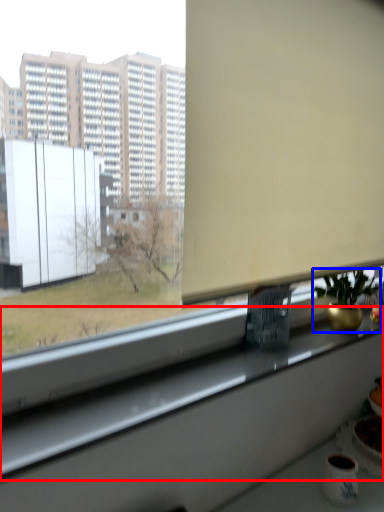
Question: Which of the following is the farthest to the observer, window sill (highlighted by a red box) or houseplant (highlighted by a blue box)?

Choices:
 (A) window sill
 (B) houseplant

Answer: (B)